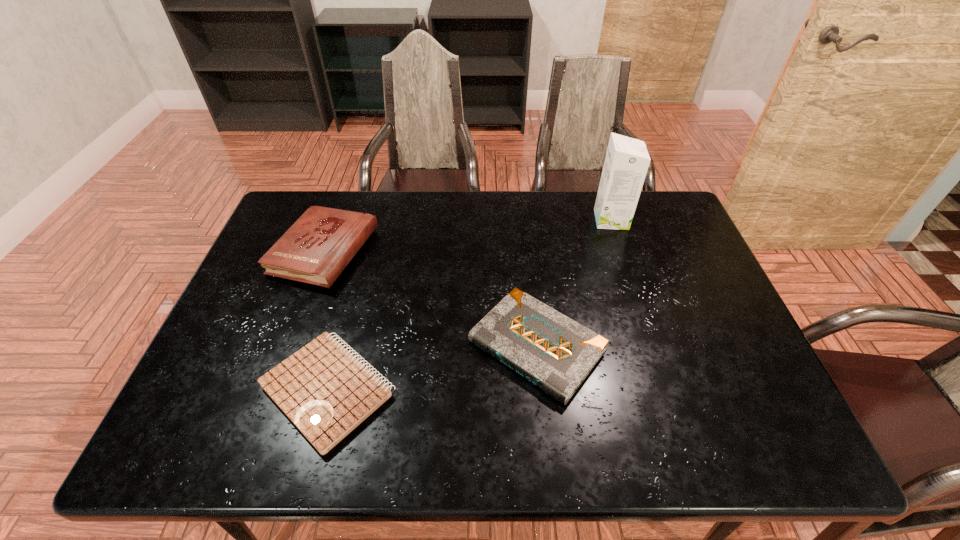
Find the location of a particular element. vacant area situated on the right of the shortest object is located at coordinates (526, 390).

Where is `carton that is at the far edge`? carton that is at the far edge is located at coordinates coord(627,160).

Identify the location of hardback book present at the far edge. (316, 249).

I want to click on object at the near edge, so click(x=324, y=390).

Find the location of a particular element. hardback book located in the left edge section of the desktop is located at coordinates (316, 249).

Image resolution: width=960 pixels, height=540 pixels. What are the coordinates of `notebook that is at the left edge` in the screenshot? It's located at (324, 390).

Image resolution: width=960 pixels, height=540 pixels. Identify the location of object positioned at the far left corner. (316, 249).

Find the location of `object at the near left corner`. object at the near left corner is located at coordinates (324, 390).

Where is `vacant space at the far edge of the desktop`? vacant space at the far edge of the desktop is located at coordinates (601, 234).

Where is `vacant space at the near edge of the desktop`? The height and width of the screenshot is (540, 960). vacant space at the near edge of the desktop is located at coordinates (256, 442).